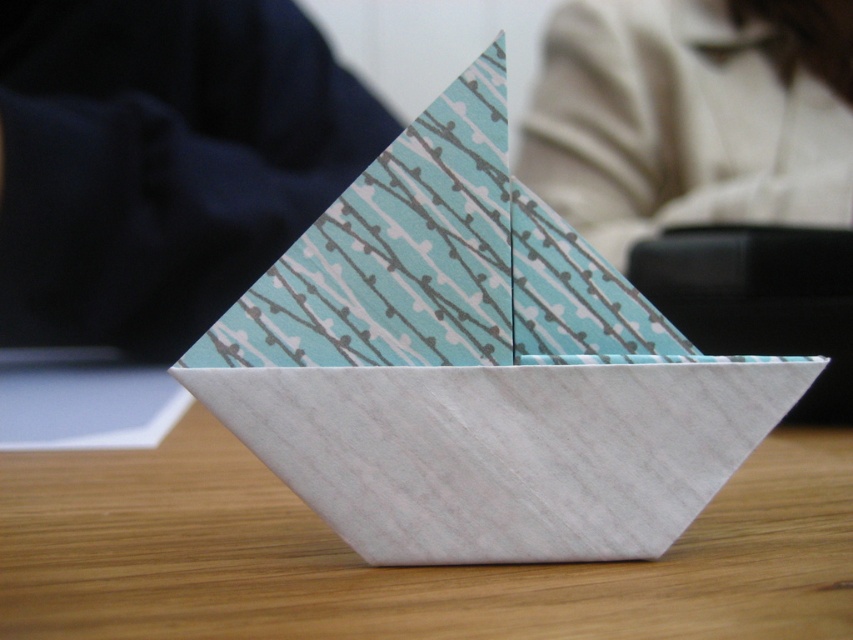
You are organizing a display of handmade crafts and need to arrange two white paper boats. The white textured paper boat at center and the white paper boat at center are both on a wooden table. Which boat is located to the right of the other?

The white textured paper boat at center is positioned on the right side of the white paper boat at center.